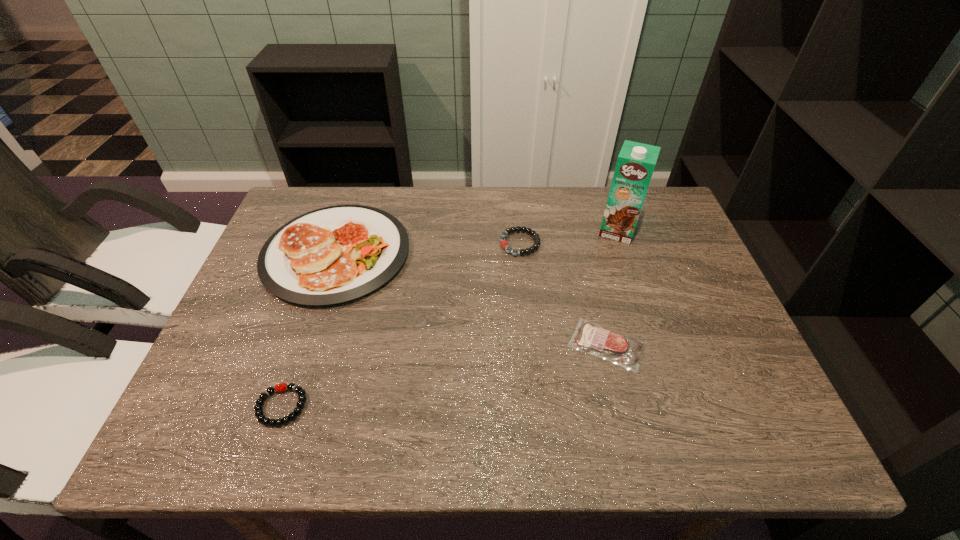
Where is `object situated at the near left corner`? object situated at the near left corner is located at coordinates (300, 404).

This screenshot has height=540, width=960. I want to click on object that is at the far right corner, so click(x=636, y=161).

This screenshot has width=960, height=540. In the image, there is a desktop. In order to click on vacant space at the far edge in this screenshot , I will do `click(444, 217)`.

Locate an element on the screen. The height and width of the screenshot is (540, 960). free space at the near edge is located at coordinates (440, 436).

Where is `vacant space at the left edge of the desktop`? vacant space at the left edge of the desktop is located at coordinates (278, 342).

Locate an element on the screen. vacant space at the right edge of the desktop is located at coordinates (699, 302).

The height and width of the screenshot is (540, 960). What are the coordinates of `free space at the far left corner of the desktop` in the screenshot? It's located at (309, 196).

Locate an element on the screen. vacant space at the near left corner of the desktop is located at coordinates (174, 452).

In the image, there is a desktop. Where is `vacant area at the far right corner`? The height and width of the screenshot is (540, 960). vacant area at the far right corner is located at coordinates (680, 221).

You are a GUI agent. You are given a task and a screenshot of the screen. Output one action in this format:
    pyautogui.click(x=<x>, y=<y>)
    Task: Click on the vacant position at the near right corner of the desktop
    The height and width of the screenshot is (540, 960).
    Given the screenshot: What is the action you would take?
    pyautogui.click(x=756, y=414)